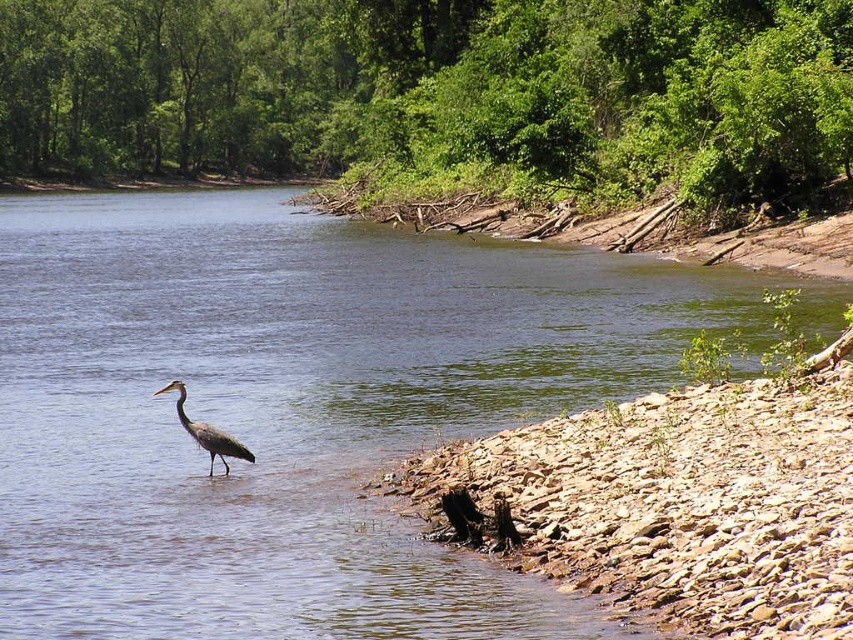
You are standing at the riverside and want to reach a specific point marked as point [318,417]. If your current position is 50 feet away from that point, how much farther do you need to walk to reach it?

The distance of point [318,417] from viewer is 80.55 feet. Since you are currently 50 feet away from it, you need to walk an additional 30.55 feet to reach the point.

You are a photographer aiming to capture the blue water at center and the gray matte bird at center in the same frame. Which object will occupy more of the image area?

The blue water at center is larger in size than the gray matte bird at center, so it will occupy more of the image area.

You are standing on the riverside and see the blue water at center and the gray matte bird at center. Which object is closer to you?

The gray matte bird at center is closer to you because it is positioned under the blue water at center, which is above it.